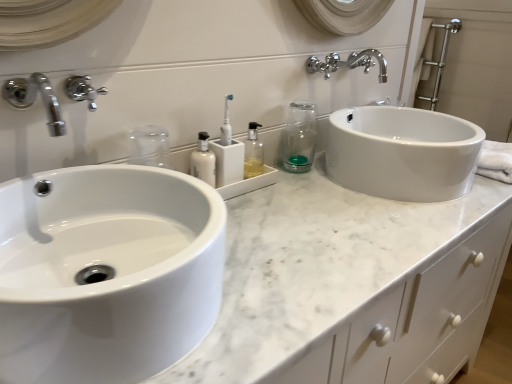
What do you see at coordinates (35, 99) in the screenshot? The height and width of the screenshot is (384, 512). I see `chrome/metallic faucet at upper left, which is the 2th tap in back-to-front order` at bounding box center [35, 99].

Describe the element at coordinates (226, 124) in the screenshot. The image size is (512, 384). I see `white plastic toothbrush at center` at that location.

Locate an element on the screen. Image resolution: width=512 pixels, height=384 pixels. white plastic toothbrush at center is located at coordinates (226, 124).

Locate an element on the screen. The width and height of the screenshot is (512, 384). polished chrome faucet at upper center is located at coordinates (323, 64).

How different are the orientations of white marble countertop at center and polished chrome faucet at upper center in degrees?

0.31 degrees.

From the image's perspective, between white marble countertop at center and polished chrome faucet at upper center, who is located below?

white marble countertop at center.

Does point (375, 229) appear closer or farther from the camera than point (314, 66)?

Point (375, 229) appears to be closer to the viewer than point (314, 66).

This screenshot has width=512, height=384. Find the location of `counter top located underneath the polished chrome faucet at upper center (from a real-world perspective)`. counter top located underneath the polished chrome faucet at upper center (from a real-world perspective) is located at coordinates (334, 279).

Could translucent plastic bottle at center be considered to be inside white marble countertop at center?

No, translucent plastic bottle at center is not inside white marble countertop at center.

Is white marble countertop at center bigger than translucent plastic bottle at center?

Yes.

Can you confirm if white marble countertop at center is shorter than translucent plastic bottle at center?

No, white marble countertop at center is not shorter than translucent plastic bottle at center.

Measure the distance between chrome/metallic faucet at upper left, marked as the first tap in a back-to-front arrangement, and white marble countertop at center.

chrome/metallic faucet at upper left, marked as the first tap in a back-to-front arrangement, is 25.44 inches away from white marble countertop at center.

Is point (78, 100) positioned behind point (480, 177)?

No, (78, 100) is in front of (480, 177).

Is chrome/metallic faucet at upper left, marked as the first tap in a back-to-front arrangement, not inside white marble countertop at center?

Yes, chrome/metallic faucet at upper left, marked as the first tap in a back-to-front arrangement, is located beyond the bounds of white marble countertop at center.

Which is in front, chrome/metallic faucet at upper left, the 2th tap positioned from the front, or white marble countertop at center?

white marble countertop at center is more forward.

Is white glossy sink at left next to chrome/metallic faucet at upper left, which is the 2th tap in back-to-front order, and touching it?

No.

Looking at this image, measure the distance from white glossy sink at left to chrome/metallic faucet at upper left, which is the first tap in front-to-back order.

white glossy sink at left and chrome/metallic faucet at upper left, which is the first tap in front-to-back order, are 8.70 inches apart.

Considering the positions of point (173, 233) and point (46, 78), is point (173, 233) closer or farther from the camera than point (46, 78)?

Point (173, 233) appears to be closer to the viewer than point (46, 78).

Is white glossy sink at left oriented away from chrome/metallic faucet at upper left, which is the first tap in front-to-back order?

No.

Which object is wider, white matte bottle at center, which is the 1th mouthwash from left to right, or white glossy sink at left?

white glossy sink at left.

Is white glossy sink at left surrounded by white matte bottle at center, which is the 1th mouthwash from left to right?

No, white glossy sink at left is not a part of white matte bottle at center, which is the 1th mouthwash from left to right.

Could you measure the distance between white matte bottle at center, placed as the 1th mouthwash when sorted from front to back, and white glossy sink at left?

A distance of 37.04 centimeters exists between white matte bottle at center, placed as the 1th mouthwash when sorted from front to back, and white glossy sink at left.

From the image's perspective, between white matte bottle at center, placed as the 1th mouthwash when sorted from front to back, and white glossy sink at left, who is located below?

white glossy sink at left.

Is transparent glass at center, which appears as the 1th mouthwash when viewed from the right, oriented away from white matte bottle at center, positioned as the 2th mouthwash in right-to-left order?

transparent glass at center, which appears as the 1th mouthwash when viewed from the right, is not turned away from white matte bottle at center, positioned as the 2th mouthwash in right-to-left order.

Is point (283, 155) closer or farther from the camera than point (209, 164)?

Point (283, 155) appears to be farther away from the viewer than point (209, 164).

In order to click on mouthwash that appears behind the white matte bottle at center, which is the 1th mouthwash from left to right in this screenshot , I will do `click(298, 137)`.

Is chrome/metallic faucet at upper left, marked as the first tap in a back-to-front arrangement, with white glossy sink at left?

chrome/metallic faucet at upper left, marked as the first tap in a back-to-front arrangement, and white glossy sink at left are not in contact.

Does chrome/metallic faucet at upper left, the 2th tap positioned from the front, contain white glossy sink at left?

No, white glossy sink at left is not a part of chrome/metallic faucet at upper left, the 2th tap positioned from the front.

From a real-world perspective, does chrome/metallic faucet at upper left, the 2th tap positioned from the front, sit lower than white glossy sink at left?

No, from a real-world perspective, chrome/metallic faucet at upper left, the 2th tap positioned from the front, is not below white glossy sink at left.

Considering the relative positions of chrome/metallic faucet at upper left, the 2th tap positioned from the front, and white glossy sink at left in the image provided, is chrome/metallic faucet at upper left, the 2th tap positioned from the front, to the left or to the right of white glossy sink at left?

Clearly, chrome/metallic faucet at upper left, the 2th tap positioned from the front, is on the left of white glossy sink at left in the image.

Locate an element on the screen. The width and height of the screenshot is (512, 384). counter top below the polished chrome faucet at upper center (from the image's perspective) is located at coordinates (334, 279).

Find the location of `counter top below the translucent plastic bottle at center (from a real-world perspective)`. counter top below the translucent plastic bottle at center (from a real-world perspective) is located at coordinates (334, 279).

Estimate the real-world distances between objects in this image. Which object is further from polished chrome faucet at upper center, chrome/metallic faucet at upper left, the 2th tap positioned from the front, or chrome/metallic faucet at upper left, which is the first tap in front-to-back order?

chrome/metallic faucet at upper left, which is the first tap in front-to-back order.

Based on their spatial positions, is chrome/metallic faucet at upper left, which is the first tap in front-to-back order, or white matte bottle at center, which is the 2th mouthwash in back-to-front order, further from white plastic toothbrush at center?

Among the two, chrome/metallic faucet at upper left, which is the first tap in front-to-back order, is located further to white plastic toothbrush at center.

When comparing their distances from translucent plastic bottle at center, does transparent glass at center, the 2th mouthwash in the left-to-right sequence, or chrome/metallic faucet at upper left, the 2th tap positioned from the front, seem closer?

transparent glass at center, the 2th mouthwash in the left-to-right sequence, is closer to translucent plastic bottle at center.

Which object lies nearer to the anchor point white matte bottle at center, which is the 1th mouthwash from left to right, polished chrome faucet at upper center or translucent plastic bottle at center?

translucent plastic bottle at center is positioned closer to the anchor white matte bottle at center, which is the 1th mouthwash from left to right.

When comparing their distances from transparent glass at center, the 1th mouthwash viewed from the back, does polished chrome faucet at upper center or chrome/metallic faucet at upper left, the 2th tap positioned from the front, seem closer?

The object closer to transparent glass at center, the 1th mouthwash viewed from the back, is polished chrome faucet at upper center.

Estimate the real-world distances between objects in this image. Which object is closer to transparent glass at center, which appears as the 1th mouthwash when viewed from the right, white marble countertop at center or white plastic toothbrush at center?

Based on the image, white plastic toothbrush at center appears to be nearer to transparent glass at center, which appears as the 1th mouthwash when viewed from the right.

Considering their positions, is transparent glass at center, the second mouthwash viewed from the front, positioned further to chrome/metallic faucet at upper left, which is the first tap in front-to-back order, than polished chrome faucet at upper center?

polished chrome faucet at upper center is further to chrome/metallic faucet at upper left, which is the first tap in front-to-back order.

When comparing their distances from white plastic toothbrush at center, does white matte bottle at center, positioned as the 2th mouthwash in right-to-left order, or white glossy sink at left seem further?

white glossy sink at left lies further to white plastic toothbrush at center than the other object.

This screenshot has height=384, width=512. Find the location of `mouthwash positioned between chrome/metallic faucet at upper left, the 2th tap positioned from the front, and translucent plastic bottle at center from near to far`. mouthwash positioned between chrome/metallic faucet at upper left, the 2th tap positioned from the front, and translucent plastic bottle at center from near to far is located at coordinates (203, 161).

Where is `toiletry between white plastic toothbrush at center and transparent glass at center, the 2th mouthwash in the left-to-right sequence, in the horizontal direction`? toiletry between white plastic toothbrush at center and transparent glass at center, the 2th mouthwash in the left-to-right sequence, in the horizontal direction is located at coordinates (253, 153).

Identify the location of toiletry located between white matte bottle at center, placed as the 1th mouthwash when sorted from front to back, and transparent glass at center, the second mouthwash viewed from the front, in the left-right direction. (253, 153).

I want to click on tap positioned between chrome/metallic faucet at upper left, which is the 2th tap in back-to-front order, and white plastic toothbrush at center from near to far, so click(83, 90).